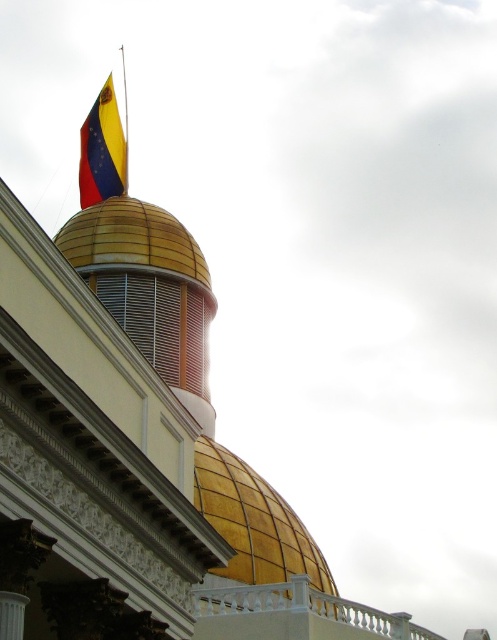
You are an architect analyzing the building facade. You notice the gold metallic dome at upper center and the yellow and red fabric flag at upper left. Which object occupies a larger area on the facade?

The yellow and red fabric flag at upper left occupies a larger area on the facade than the gold metallic dome at upper center.

You are an architect analyzing the building facade. You need to determine if the gold metallic dome at upper center can be covered by a protective cover designed for the yellow and red fabric flag at upper left. Based on their sizes, is this feasible?

The gold metallic dome at upper center has a lesser width compared to the yellow and red fabric flag at upper left. Therefore, the protective cover designed for the flag might be too large to effectively cover the dome, as the dome is narrower. A cover tailored to the flag may not fit the dome properly due to the size difference.

You are standing in front of the building with the golden dome. There are two points marked on the dome at coordinates point (219, 486) and point (96, 198). If you want to touch the point that is closer to you, which one should you choose?

You should choose point (219, 486) because it is closer to the camera than point (96, 198).